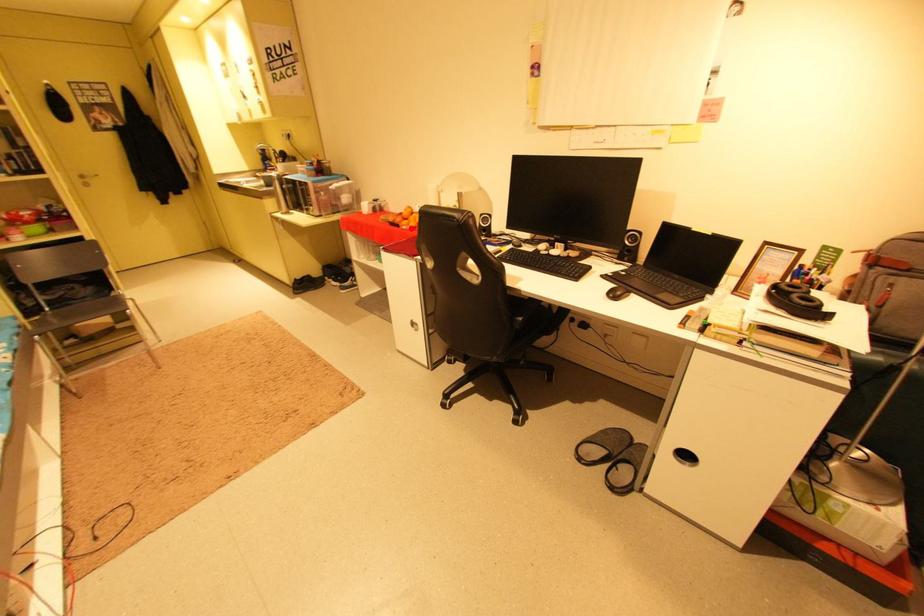
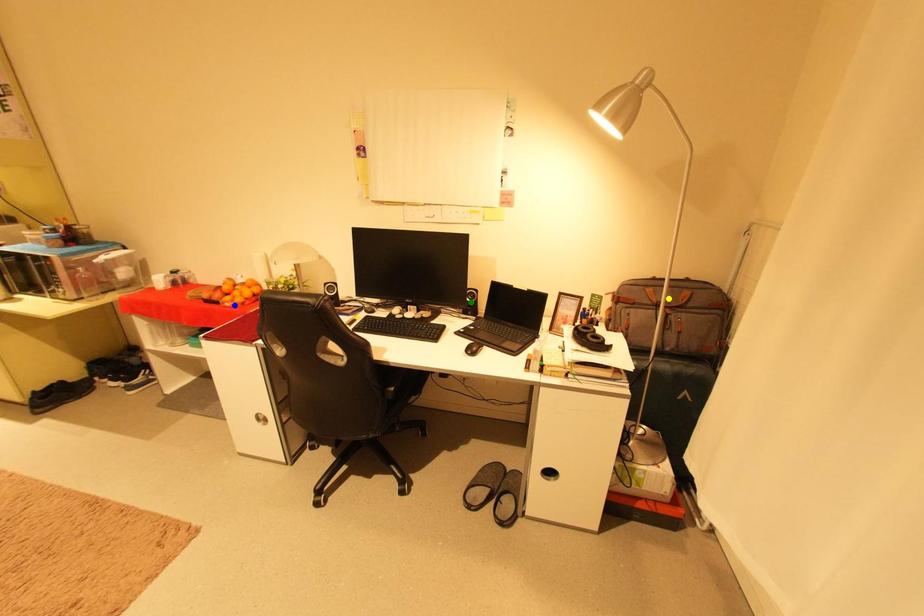
Question: I am providing you with two images of the same scene from different viewpoints. A red point is marked on the first image. You are given multiple points on the second image. Which mark in image 2 goes with the point in image 1?

Choices:
 (A) blue point
 (B) green point
 (C) yellow point

Answer: (A)